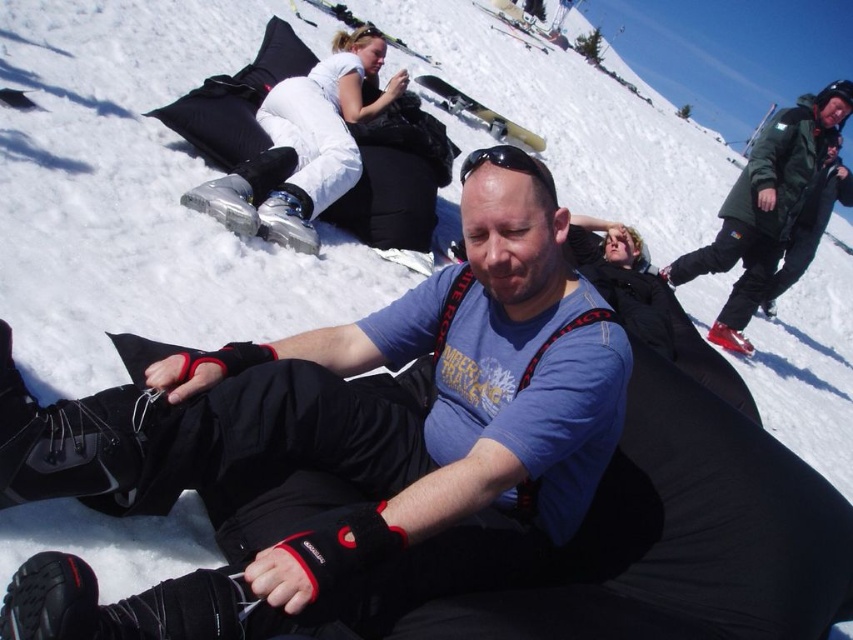
You are a photographer taking a picture of the matte black gloves at center and the green matte jacket at upper right. Which object should you zoom in on to capture more detail without moving the camera?

The matte black gloves at center has a smaller size compared to the green matte jacket at upper right, so you should zoom in on the matte black gloves at center to capture more detail since it is smaller and requires closer focus.

In the scene shown: You are a photographer trying to capture a closeup shot of the matte black gloves at center and the green matte jacket at upper right. Since you want both objects to be in focus, which one should you adjust your camera lens to focus on first?

The matte black gloves at center is shorter than the green matte jacket at upper right, so you should focus on the matte black gloves at center first to ensure both are in focus.

You are planning to take a photo of the scene. You need to ensure that both the matte black gloves at center and the green matte jacket at upper right are clearly visible in the frame. Based on their sizes, which object should you focus on first to ensure proper focus?

The matte black gloves at center has a lesser width compared to green matte jacket at upper right, so you should focus on the green matte jacket at upper right first since it is larger and easier to detect in the frame.